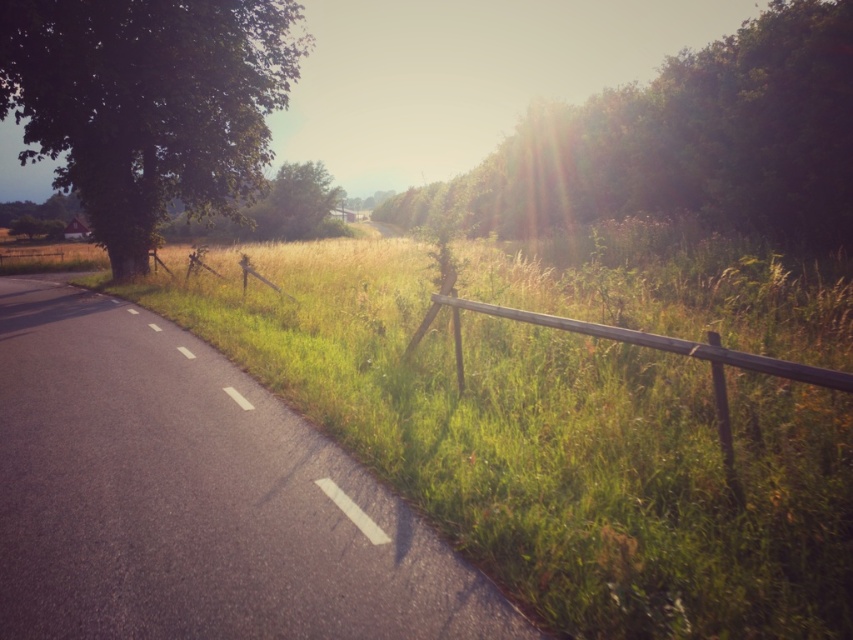
You are standing at the point marked by the coordinates (x=552, y=445) in the image. Based on the scene description, what is the immediate environment around you?

The point marked by the coordinates (x=552, y=445) corresponds to the green grass at center, which is part of the grassy area bordering the road and transitioning into a field of tall, golden grasses.

You are standing at the point marked by coordinates (552, 445) in the image. What do you see directly in front of you?

You see green grass at center directly in front of you at the point marked by coordinates (552, 445).

You are standing on the paved road and want to walk towards the green leafy tree at left. Which direction should you walk to avoid the green grass at center?

To reach the green leafy tree at left while avoiding the green grass at center, you should walk to the left side of the road since the green grass at center is positioned to the right of the green leafy tree at left.